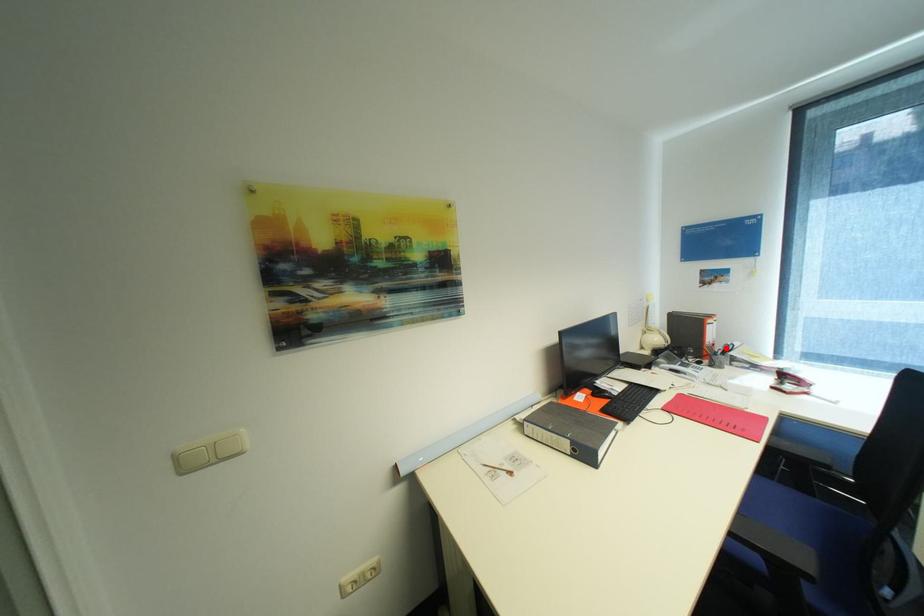
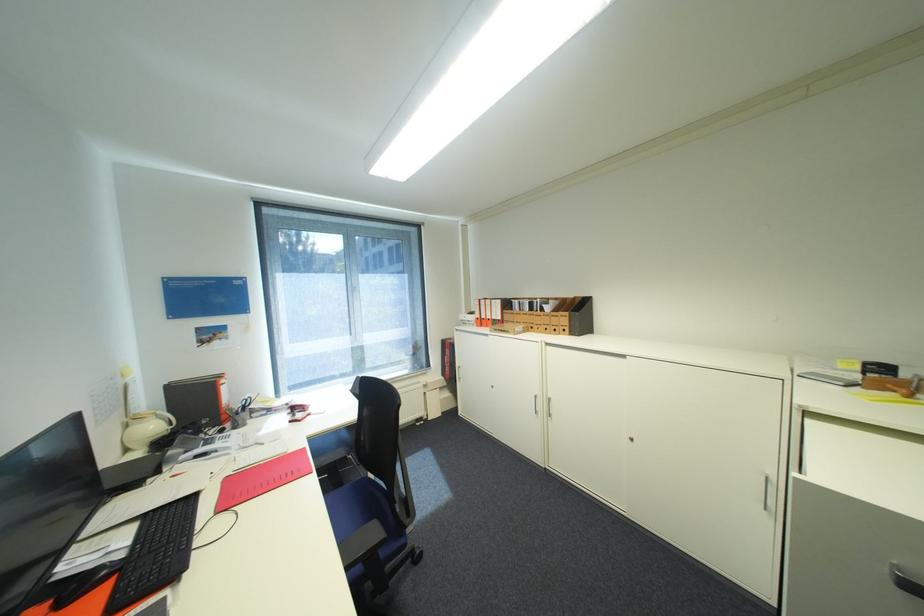
Find the pixel in the second image that matches the highlighted location in the first image.

(246, 406)